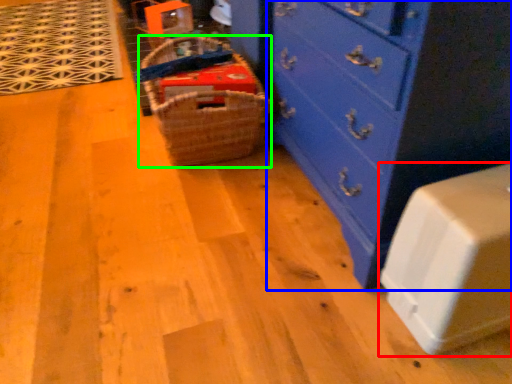
Question: Which is nearer to the cabinetry (highlighted by a red box)? chest of drawers (highlighted by a blue box) or basket (highlighted by a green box).

Choices:
 (A) chest of drawers
 (B) basket

Answer: (A)